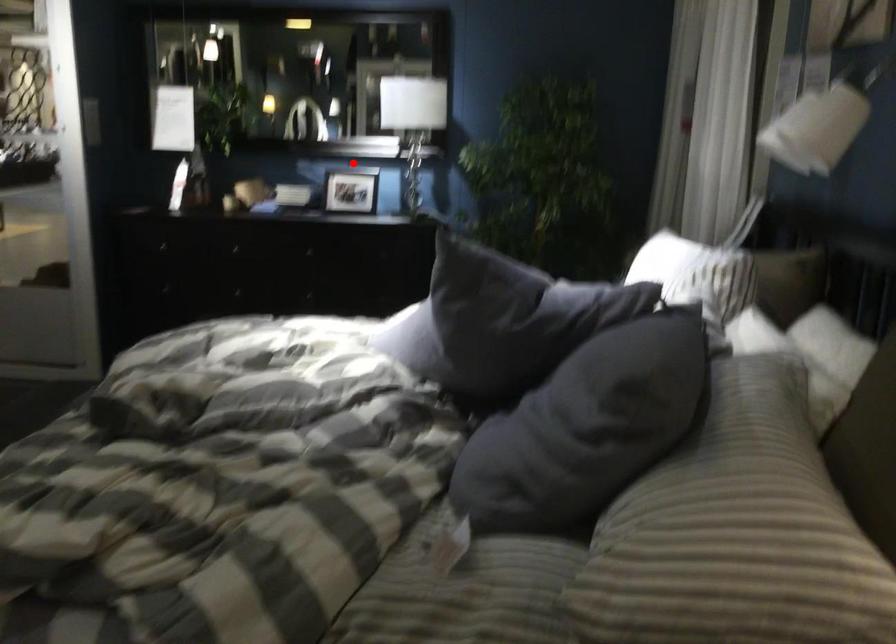
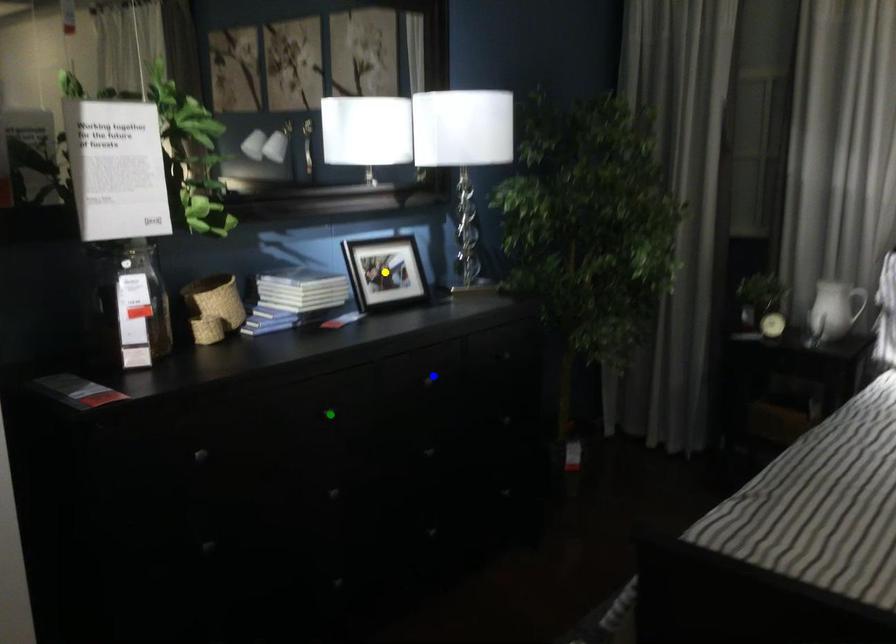
Question: I am providing you with two images of the same scene from different viewpoints. A red point is marked on the first image. You are given multiple points on the second image. Which spot in image 2 lines up with the point in image 1?

Choices:
 (A) yellow point
 (B) green point
 (C) blue point

Answer: (A)